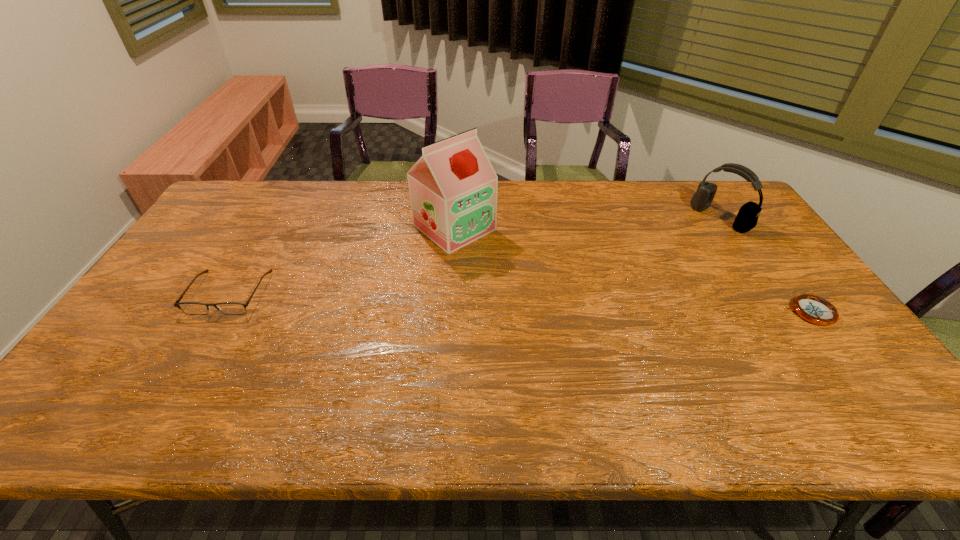
Find the location of a particular element. free region located 0.260m with the cap open on the soya milk is located at coordinates coord(541,293).

Find the location of `free location located on the headband of the headset`. free location located on the headband of the headset is located at coordinates [x=636, y=273].

You are a GUI agent. You are given a task and a screenshot of the screen. Output one action in this format:
    pyautogui.click(x=<x>, y=<y>)
    Task: Click on the free spot located 0.100m on the headband of the headset
    
    Given the screenshot: What is the action you would take?
    pyautogui.click(x=689, y=240)

The image size is (960, 540). Find the location of `vacant space located 0.340m on the headband of the headset`. vacant space located 0.340m on the headband of the headset is located at coordinates (641, 271).

You are a GUI agent. You are given a task and a screenshot of the screen. Output one action in this format:
    pyautogui.click(x=<x>, y=<y>)
    Task: Click on the soya milk positioned at the far edge
    The image size is (960, 540).
    Given the screenshot: What is the action you would take?
    pyautogui.click(x=453, y=187)

This screenshot has height=540, width=960. I want to click on headset that is positioned at the far edge, so click(747, 217).

Locate an element on the screen. The height and width of the screenshot is (540, 960). object positioned at the left edge is located at coordinates (231, 308).

Identify the location of compass situated at the right edge. coord(814,309).

At what (x,y) coordinates should I click in order to perform the action: click on headset situated at the right edge. Please return your answer as a coordinate pair (x, y). Looking at the image, I should click on (747, 217).

Locate an element on the screen. The width and height of the screenshot is (960, 540). object located at the far right corner is located at coordinates (747, 217).